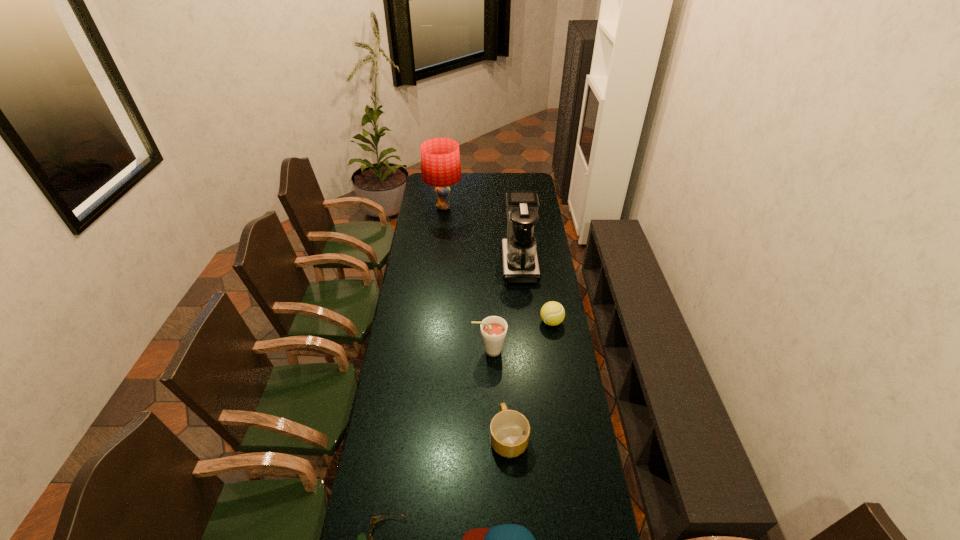
You are a GUI agent. You are given a task and a screenshot of the screen. Output one action in this format:
    pyautogui.click(x=<x>, y=<y>)
    Task: Click on the vacant space that satisfies the following two spatial constraints: 1. on the side with the handle of the mug; 2. on the drink side of the third tallest object
    
    Given the screenshot: What is the action you would take?
    pyautogui.click(x=504, y=350)

I want to click on free space that satisfies the following two spatial constraints: 1. on the side with the handle of the mug; 2. on the drink side of the fourth nearest object, so pyautogui.click(x=504, y=350).

Locate an element on the screen. free location that satisfies the following two spatial constraints: 1. at the front of the coffee maker where the controls are located; 2. on the back side of the third farthest object is located at coordinates (525, 322).

You are a GUI agent. You are given a task and a screenshot of the screen. Output one action in this format:
    pyautogui.click(x=<x>, y=<y>)
    Task: Click on the blank space that satisfies the following two spatial constraints: 1. on the drink side of the root beer; 2. on the side with the handle of the fifth farthest object
    The image size is (960, 540).
    Given the screenshot: What is the action you would take?
    pyautogui.click(x=491, y=437)

Identify the location of free space that satisfies the following two spatial constraints: 1. on the side with the handle of the mug; 2. on the drink side of the fifth shortest object. Image resolution: width=960 pixels, height=540 pixels. (504, 350).